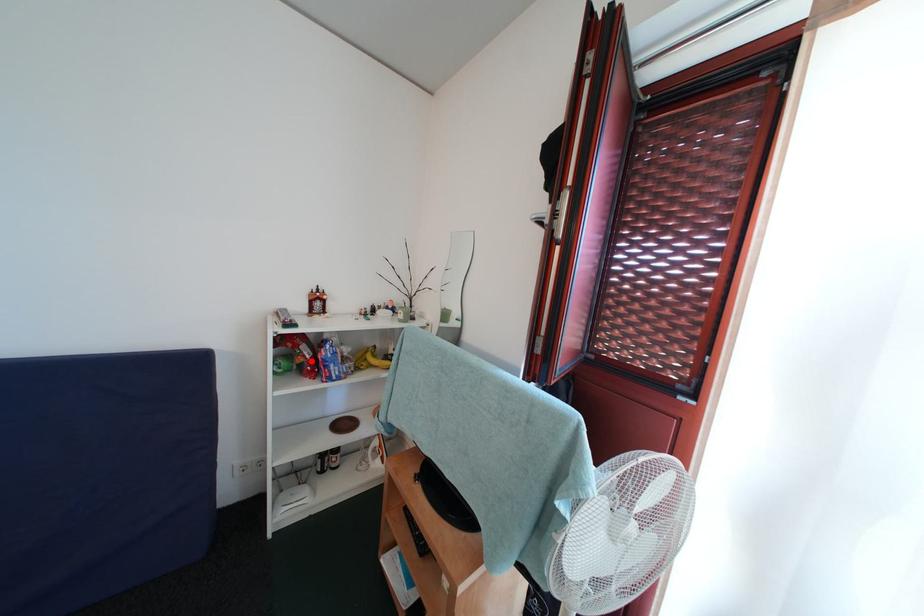
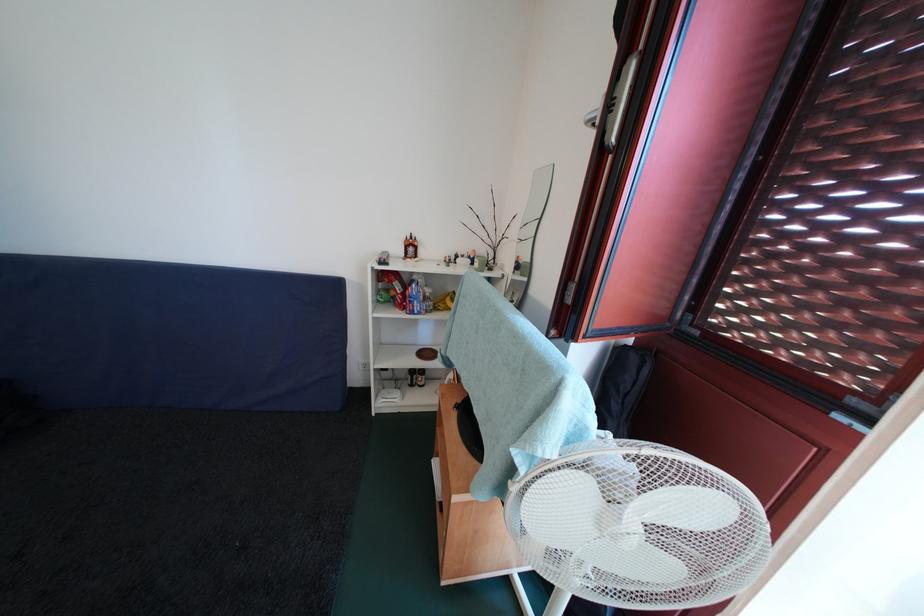
Where in the second image is the point corresponding to the highlighted location from the first image?

(403, 296)